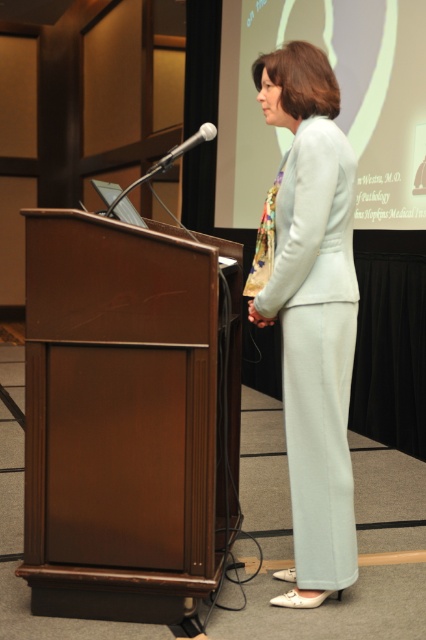
Does light blue fabric suit at center have a lesser height compared to white plastic microphone at center?

In fact, light blue fabric suit at center may be taller than white plastic microphone at center.

Is point (340, 266) closer to camera compared to point (164, 157)?

No.

Locate an element on the screen. Image resolution: width=426 pixels, height=640 pixels. light blue fabric suit at center is located at coordinates (313, 314).

Who is more distant from viewer, (193, 461) or (161, 157)?

The point (161, 157) is more distant.

Between brown polished wood podium at center and white plastic microphone at center, which one has less height?

With less height is white plastic microphone at center.

Is point (169, 596) positioned after point (199, 128)?

No, it is in front of (199, 128).

The width and height of the screenshot is (426, 640). What are the coordinates of `brown polished wood podium at center` in the screenshot? It's located at (124, 417).

Who is lower down, brown polished wood podium at center or light blue fabric at center?

brown polished wood podium at center

Can you confirm if brown polished wood podium at center is positioned above light blue fabric at center?

No.

What do you see at coordinates (124, 417) in the screenshot?
I see `brown polished wood podium at center` at bounding box center [124, 417].

Find the location of `brown polished wood podium at center`. brown polished wood podium at center is located at coordinates pyautogui.click(x=124, y=417).